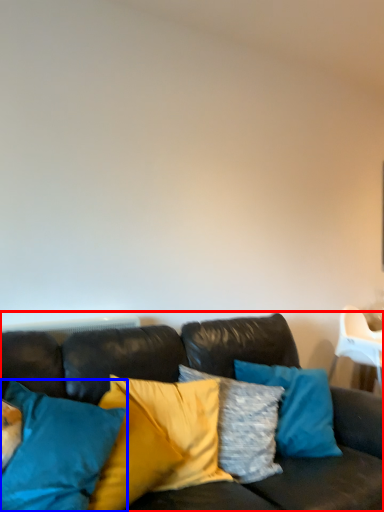
Question: Among these objects, which one is nearest to the camera, studio couch (highlighted by a red box) or pillow (highlighted by a blue box)?

Choices:
 (A) studio couch
 (B) pillow

Answer: (A)